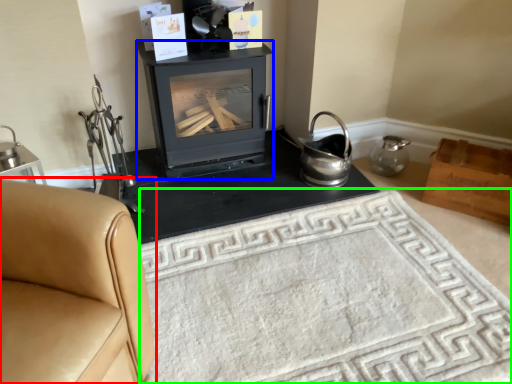
Question: Considering the real-world distances, which object is farthest from furniture (highlighted by a red box)? wood burning stove (highlighted by a blue box) or doormat (highlighted by a green box)?

Choices:
 (A) wood burning stove
 (B) doormat

Answer: (A)